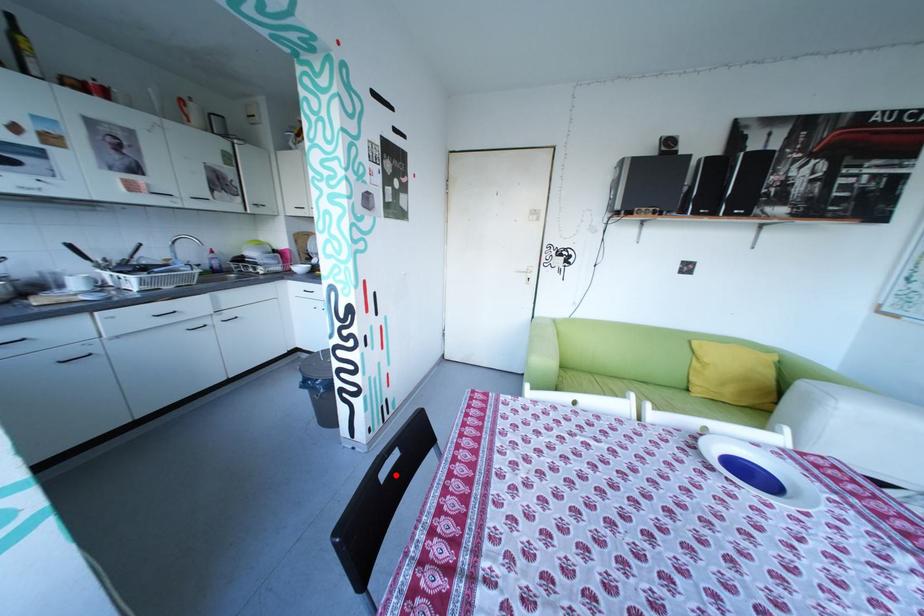
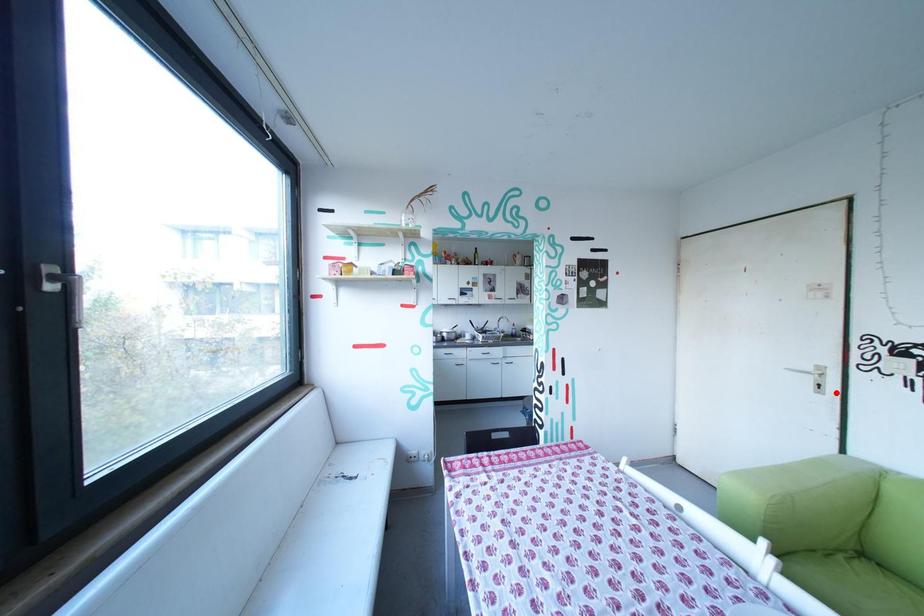
I am providing you with two images of the same scene from different viewpoints. A red point is marked on the first image and another point is marked on the second image. Are the points marked in image1 and image2 representing the same 3D position?

No